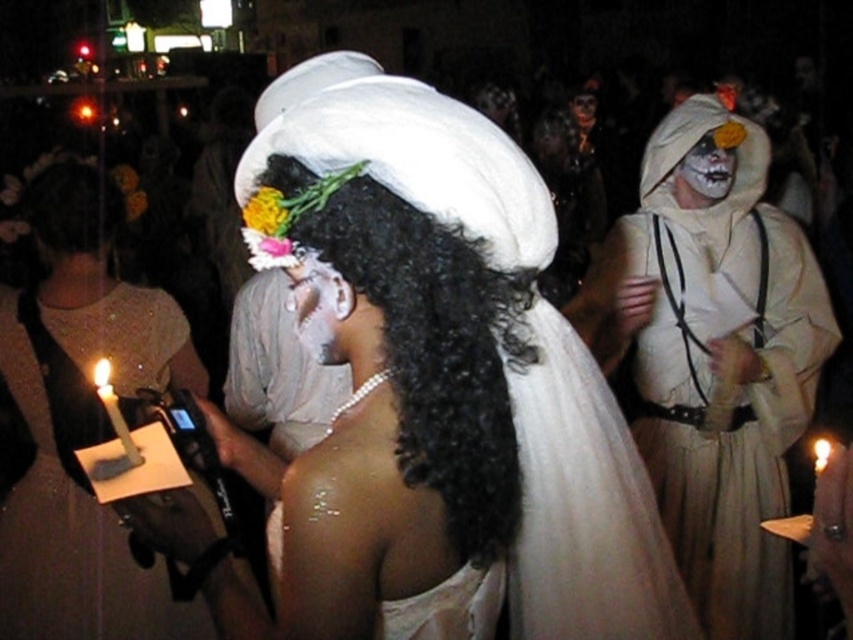
You are standing at the origin point of the scene. Which of the two points, point (299, 307) or point (717, 131), is closer to you?

Point (299, 307) is closer to you because it is in front of point (717, 131).

You are a photographer at this event and want to take a group photo of the central figure and the person in the white hooded robe with black suspenders. You need to position them so that they are exactly 6.67 feet apart. Is the distance between the central figure and the white satin dress at lower left sufficient for this requirement?

The distance between the central figure and the white satin dress at lower left is exactly 6.67 feet, so yes, positioning them at this distance would meet the requirement.